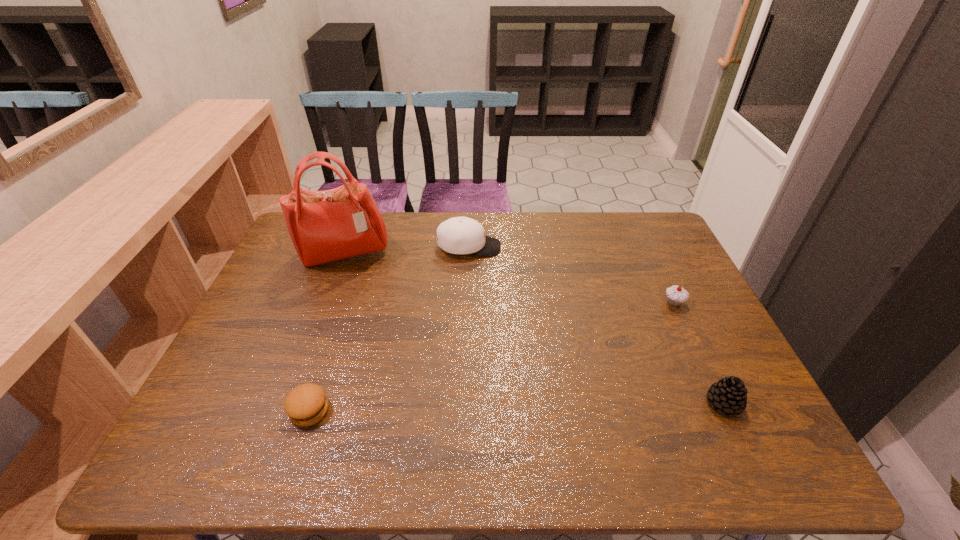
Locate an element on the screen. This screenshot has width=960, height=540. vacant space at the far right corner is located at coordinates (633, 224).

The image size is (960, 540). Find the location of `vacant area between the pinecone and the hamburger`. vacant area between the pinecone and the hamburger is located at coordinates (516, 407).

Identify the location of free space that is in between the third nearest object and the handbag. (510, 278).

Locate an element on the screen. This screenshot has width=960, height=540. vacant space in between the third farthest object and the pinecone is located at coordinates (699, 353).

The image size is (960, 540). Find the location of `empty space between the tallest object and the third nearest object`. empty space between the tallest object and the third nearest object is located at coordinates (510, 278).

You are a GUI agent. You are given a task and a screenshot of the screen. Output one action in this format:
    pyautogui.click(x=<x>, y=<y>)
    Task: Click on the vacant region between the cupcake and the pinecone
    The height and width of the screenshot is (540, 960).
    Given the screenshot: What is the action you would take?
    pyautogui.click(x=699, y=353)

The height and width of the screenshot is (540, 960). I want to click on vacant area that lies between the cupcake and the shortest object, so click(492, 356).

I want to click on free space between the tallest object and the cupcake, so click(510, 278).

I want to click on empty space that is in between the hamburger and the baseball cap, so click(389, 329).

The width and height of the screenshot is (960, 540). Identify the location of vacant space in between the tallest object and the shortest object. (327, 332).